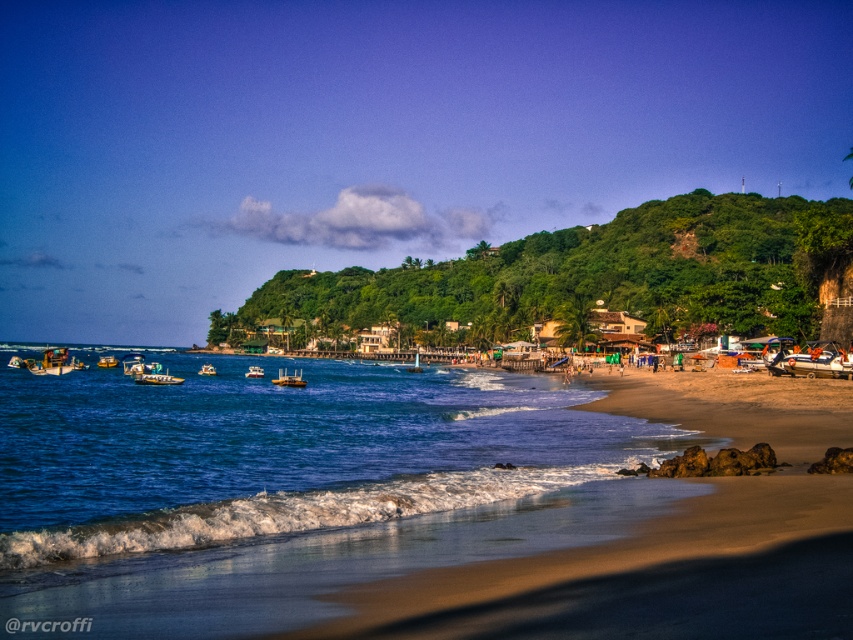
Question: Among these points, which one is farthest from the camera?

Choices:
 (A) (136, 355)
 (B) (79, 362)

Answer: (A)

Question: Which point is closer to the camera taking this photo?

Choices:
 (A) (12, 563)
 (B) (204, 364)
 (C) (164, 378)

Answer: (A)

Question: Does metallic yellow boat at center appear on the right side of metallic silver boat at left?

Choices:
 (A) yes
 (B) no

Answer: (A)

Question: Does blue water at lower left have a larger size compared to metallic silver boat at center?

Choices:
 (A) no
 (B) yes

Answer: (B)

Question: Estimate the real-world distances between objects in this image. Which object is farther from the metallic yellow boat at center?

Choices:
 (A) green leafy hillside at upper center
 (B) yellow matte boat at center-left

Answer: (A)

Question: Does metallic yellow boat at center come behind translucent plastic boat at center-left?

Choices:
 (A) yes
 (B) no

Answer: (B)